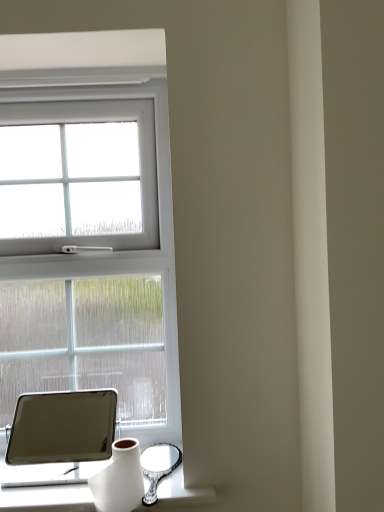
This screenshot has height=512, width=384. Describe the element at coordinates (62, 426) in the screenshot. I see `matte black tablet at lower left` at that location.

Identify the location of matte black tablet at lower left. The height and width of the screenshot is (512, 384). (x=62, y=426).

Find the location of a particular element. white glossy vase at lower left is located at coordinates (119, 479).

What do you see at coordinates (119, 479) in the screenshot? I see `white glossy vase at lower left` at bounding box center [119, 479].

Find the location of a particular element. The width and height of the screenshot is (384, 512). matte black tablet at lower left is located at coordinates pos(62,426).

Can you confirm if white glossy vase at lower left is positioned to the left of matte black tablet at lower left?

No.

Which object is closer to the camera, white glossy vase at lower left or matte black tablet at lower left?

white glossy vase at lower left.

Considering the points (128, 500) and (12, 445), which point is behind, point (128, 500) or point (12, 445)?

The point (12, 445) is farther.

From the image's perspective, is white glossy vase at lower left located above matte black tablet at lower left?

Actually, white glossy vase at lower left appears below matte black tablet at lower left in the image.

From a real-world perspective, who is located lower, white glossy vase at lower left or matte black tablet at lower left?

From a 3D spatial view, white glossy vase at lower left is below.

In the scene shown: Which of these two, white glossy vase at lower left or matte black tablet at lower left, is thinner?

With smaller width is white glossy vase at lower left.

Who is shorter, white glossy vase at lower left or matte black tablet at lower left?

white glossy vase at lower left is shorter.

Between white glossy vase at lower left and matte black tablet at lower left, which one has smaller size?

white glossy vase at lower left is smaller.

Is white glossy vase at lower left not inside matte black tablet at lower left?

Yes.

Is white glossy vase at lower left not close to matte black tablet at lower left?

Indeed, white glossy vase at lower left is not near matte black tablet at lower left.

Could you tell me if white glossy vase at lower left is turned towards matte black tablet at lower left?

No, white glossy vase at lower left is not aimed at matte black tablet at lower left.

How different are the orientations of white glossy vase at lower left and matte black tablet at lower left in degrees?

The angle between the facing direction of white glossy vase at lower left and the facing direction of matte black tablet at lower left is 1.5 degrees.

How much distance is there between white glossy vase at lower left and matte black tablet at lower left?

A distance of 4.34 feet exists between white glossy vase at lower left and matte black tablet at lower left.

You are a GUI agent. You are given a task and a screenshot of the screen. Output one action in this format:
    pyautogui.click(x=<x>, y=<y>)
    Task: Click on the vase beneath the matte black tablet at lower left (from a real-world perspective)
    
    Given the screenshot: What is the action you would take?
    (x=119, y=479)

Which is more to the right, matte black tablet at lower left or white glossy vase at lower left?

white glossy vase at lower left.

Which object is closer to the camera, matte black tablet at lower left or white glossy vase at lower left?

white glossy vase at lower left is in front.

Consider the image. Which is closer, [65,439] or [105,479]?

Point [65,439] is positioned farther from the camera compared to point [105,479].

Looking at this image, from the image's perspective, is matte black tablet at lower left located above white glossy vase at lower left?

Correct, matte black tablet at lower left appears higher than white glossy vase at lower left in the image.

From a real-world perspective, which object stands above the other?

From a 3D spatial view, matte black tablet at lower left is above.

Looking at this image, between matte black tablet at lower left and white glossy vase at lower left, which one has smaller width?

white glossy vase at lower left is thinner.

Considering the sizes of matte black tablet at lower left and white glossy vase at lower left in the image, is matte black tablet at lower left taller or shorter than white glossy vase at lower left?

matte black tablet at lower left is taller than white glossy vase at lower left.

Does matte black tablet at lower left have a smaller size compared to white glossy vase at lower left?

Incorrect, matte black tablet at lower left is not smaller in size than white glossy vase at lower left.

Would you say matte black tablet at lower left is inside or outside white glossy vase at lower left?

matte black tablet at lower left is not inside white glossy vase at lower left, it's outside.

Is matte black tablet at lower left far away from white glossy vase at lower left?

matte black tablet at lower left is far away from white glossy vase at lower left.

Is matte black tablet at lower left oriented away from white glossy vase at lower left?

No.

Locate an element on the screen. Image resolution: width=384 pixels, height=512 pixels. vase in front of the matte black tablet at lower left is located at coordinates (119, 479).

I want to click on tablet computer on the left side of white glossy vase at lower left, so click(x=62, y=426).

The width and height of the screenshot is (384, 512). I want to click on vase that is under the matte black tablet at lower left (from a real-world perspective), so click(x=119, y=479).